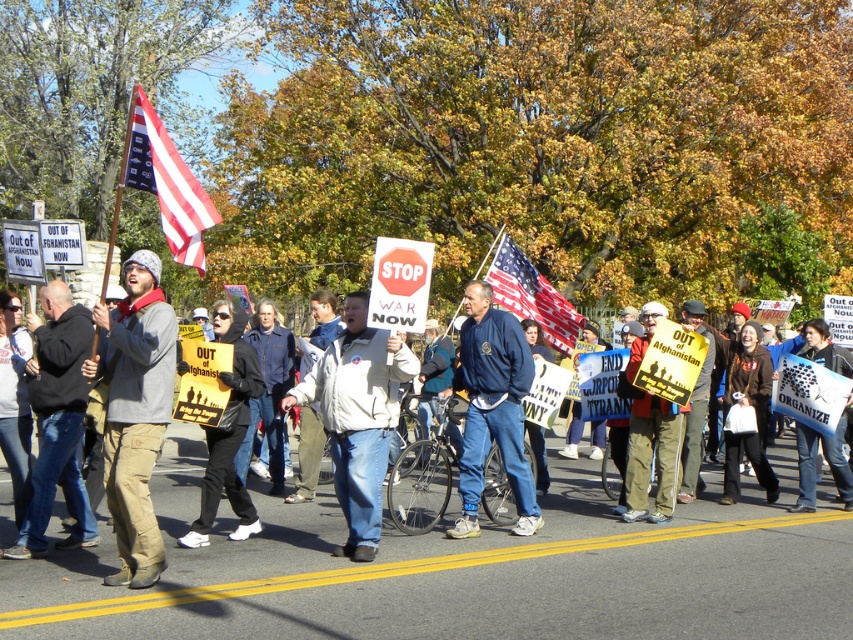
You are a photographer trying to capture a clear shot of the matte yellow sign at center without any obstructions. Given that the black jacket at left is covering part of the sign, how should you adjust your position?

The black jacket at left is positioned over the matte yellow sign at center, so you should move to the right to avoid the obstruction caused by the black jacket at left.